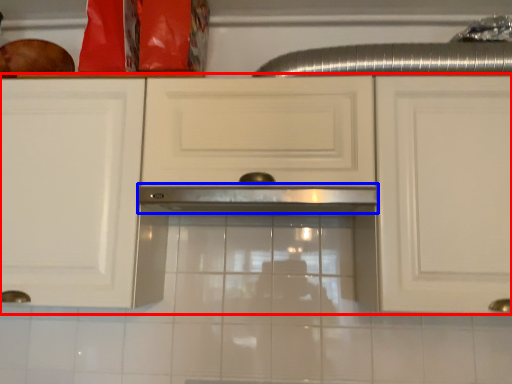
Question: Which object is closer to the camera taking this photo, cabinetry (highlighted by a red box) or exhaust hood (highlighted by a blue box)?

Choices:
 (A) cabinetry
 (B) exhaust hood

Answer: (A)